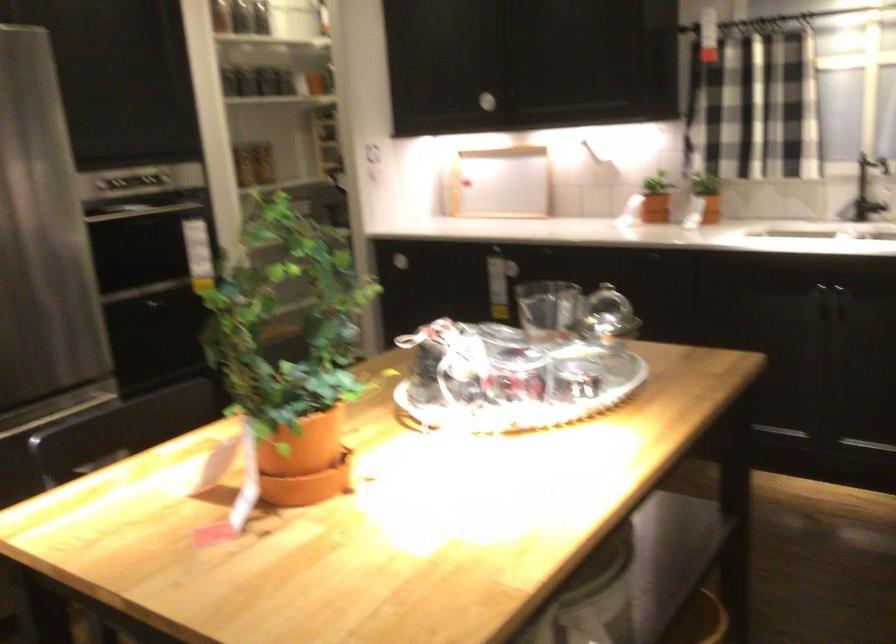
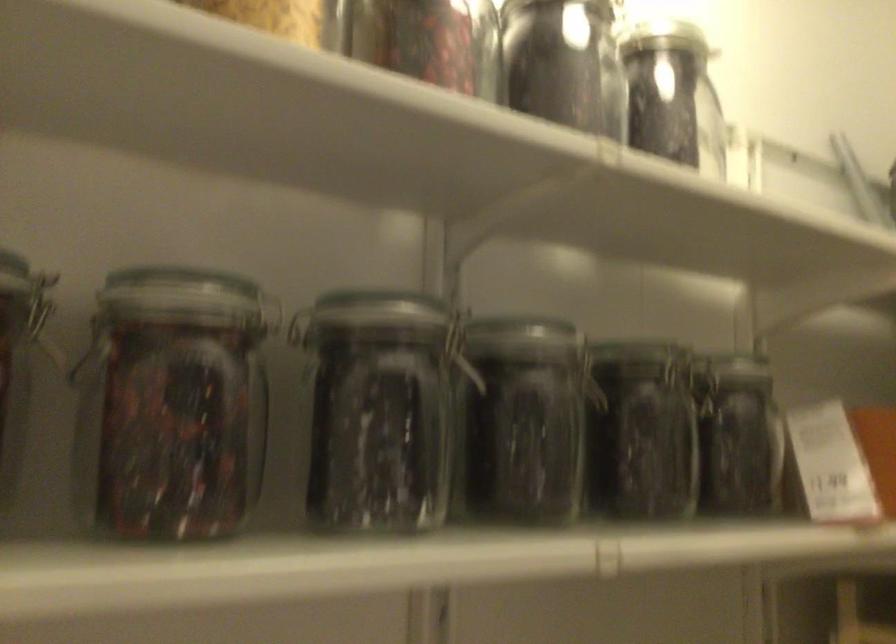
The point at [245,69] is marked in the first image. Where is the corresponding point in the second image?

(524, 420)